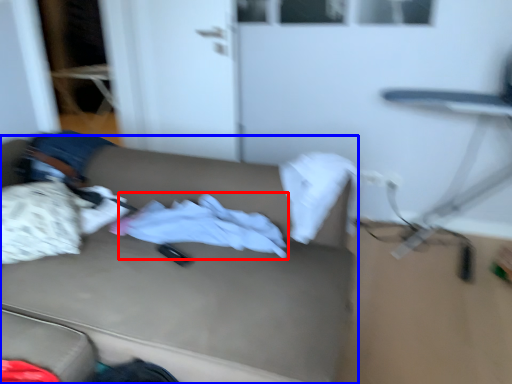
Question: Which object is further to the camera taking this photo, baby clothe (highlighted by a red box) or studio couch (highlighted by a blue box)?

Choices:
 (A) baby clothe
 (B) studio couch

Answer: (A)